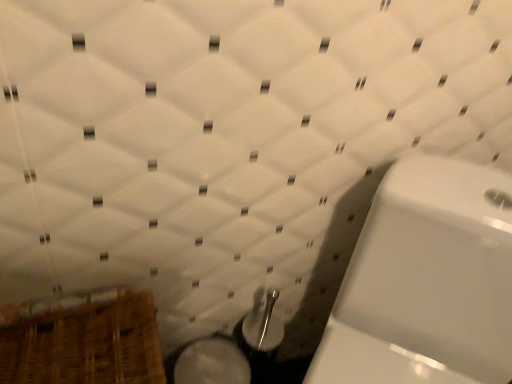
Question: Can you confirm if white glossy bidet at lower center is bigger than wooden basket at lower left?

Choices:
 (A) no
 (B) yes

Answer: (A)

Question: Is white glossy bidet at lower center taller than wooden basket at lower left?

Choices:
 (A) yes
 (B) no

Answer: (B)

Question: Is the position of white glossy bidet at lower center less distant than that of wooden basket at lower left?

Choices:
 (A) yes
 (B) no

Answer: (B)

Question: From the image's perspective, is white glossy bidet at lower center on wooden basket at lower left?

Choices:
 (A) yes
 (B) no

Answer: (B)

Question: Is wooden basket at lower left at the back of white glossy bidet at lower center?

Choices:
 (A) yes
 (B) no

Answer: (B)

Question: Considering the relative sizes of white glossy bidet at lower center and wooden basket at lower left in the image provided, is white glossy bidet at lower center thinner than wooden basket at lower left?

Choices:
 (A) yes
 (B) no

Answer: (A)

Question: Does wooden basket at lower left have a lesser height compared to white glossy bidet at lower center?

Choices:
 (A) yes
 (B) no

Answer: (B)

Question: Is wooden basket at lower left wider than white glossy bidet at lower center?

Choices:
 (A) no
 (B) yes

Answer: (B)

Question: Can we say wooden basket at lower left lies outside white glossy bidet at lower center?

Choices:
 (A) no
 (B) yes

Answer: (B)

Question: Is wooden basket at lower left to the left of white glossy bidet at lower center from the viewer's perspective?

Choices:
 (A) no
 (B) yes

Answer: (B)

Question: Would you say wooden basket at lower left is a long distance from white glossy bidet at lower center?

Choices:
 (A) no
 (B) yes

Answer: (A)

Question: Considering the relative sizes of wooden basket at lower left and white glossy bidet at lower center in the image provided, is wooden basket at lower left thinner than white glossy bidet at lower center?

Choices:
 (A) no
 (B) yes

Answer: (A)

Question: From a real-world perspective, is white glossy toilet at right over wooden basket at lower left?

Choices:
 (A) no
 (B) yes

Answer: (B)